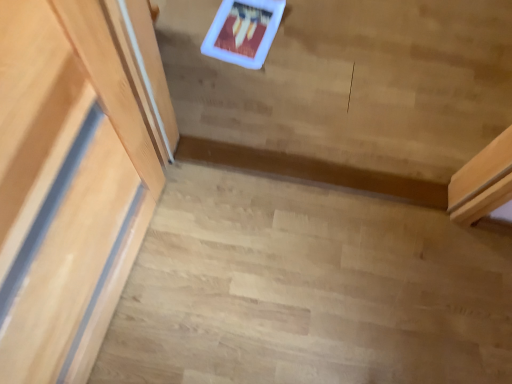
Where is `light wood door at left`? This screenshot has width=512, height=384. light wood door at left is located at coordinates (72, 177).

The width and height of the screenshot is (512, 384). What do you see at coordinates (72, 177) in the screenshot?
I see `light wood door at left` at bounding box center [72, 177].

Where is `light wood door at left`? Image resolution: width=512 pixels, height=384 pixels. light wood door at left is located at coordinates (72, 177).